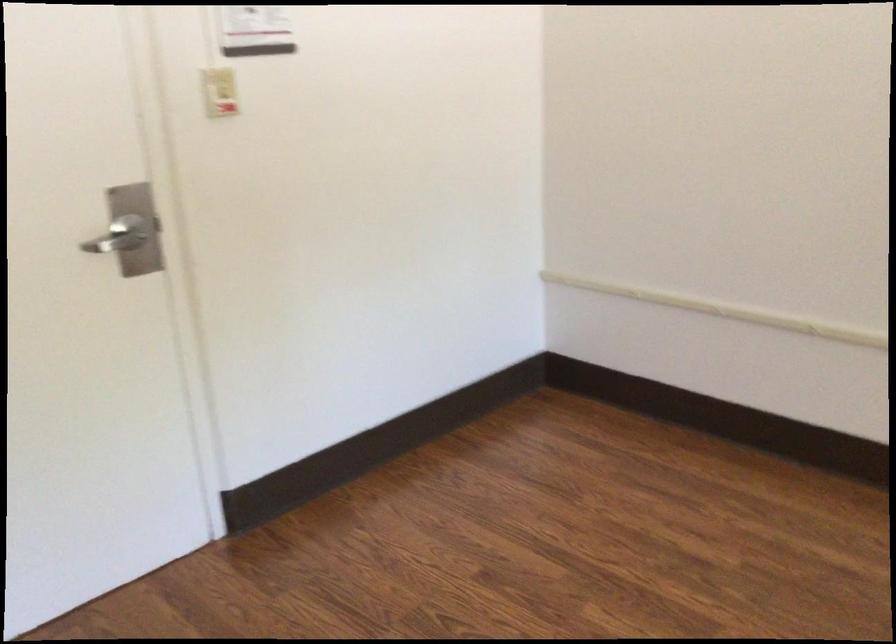
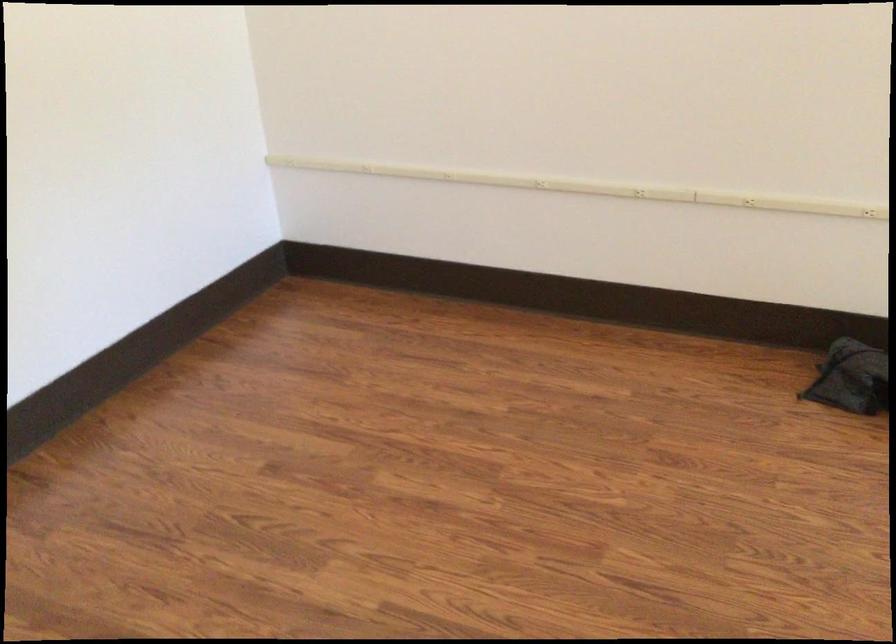
Question: The images are taken continuously from a first-person perspective. In which direction is your viewpoint rotating?

Choices:
 (A) Left
 (B) Right
 (C) Up
 (D) Down

Answer: (B)